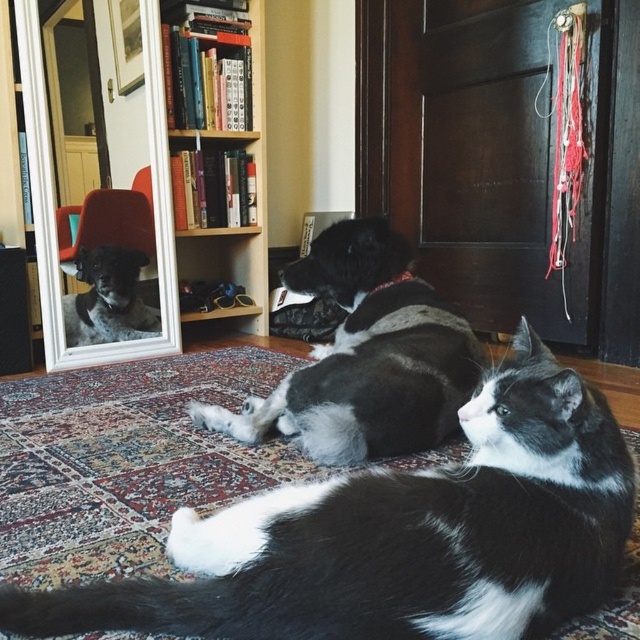
You are a photographer trying to capture a closeup shot of the black and white fur cat at center and the black and white fur at center. Which one should you focus on to ensure the subject is in sharp focus?

You should focus on the black and white fur cat at center because it is closer to the viewer than the black and white fur at center, so focusing on it will keep it sharp while the background may blur.

You are an interior designer planning to place a new painting on the wall. The painting is 0.3 meters wide and needs to be placed at point coordinates between 0.2 and 0.4 on the x and y axes. Can the wooden bookshelf at upper center, which is at point coordinates of 0.252 and 0.344, accommodate the painting without overlapping?

The wooden bookshelf at upper center is located at coordinates 0.252 and 0.344. The painting requires placement between 0.2 and 0.4 on both axes. Since the bookshelf is within this range, placing the painting there would overlap with the bookshelf, so it cannot be accommodated without overlapping.

Looking at this image, you are a toy mouse that is 1 foot long. You are placed on the floor between the black and white fur cat at center and the wooden bookshelf at upper center. Can you fit between them without touching either?

The distance between the black and white fur cat at center and the wooden bookshelf at upper center is 6.14 feet. Since the toy mouse is only 1 foot long, there is enough space for it to fit between them without touching either.